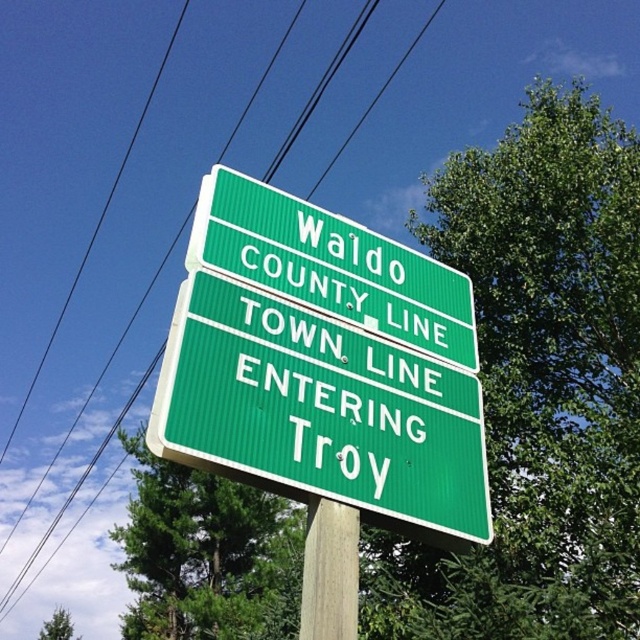
You are a photographer trying to capture the green road sign in the image. You notice the green leafy tree at center and the black wire at upper center might obstruct your view. Which object is closer to the camera and would block the sign more?

The green leafy tree at center is shorter than the black wire at upper center, so the black wire at upper center is closer to the camera and would block the sign more.

You are a hiker who just arrived at the Waldo County and Troy boundary. You see a black wire at upper center and a wooden post at center. Which object is positioned higher in the image?

The black wire at upper center is positioned higher in the image than the wooden post at center.